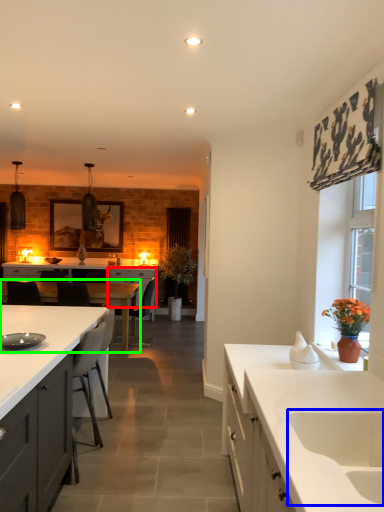
Question: Which is nearer to the cabinetry (highlighted by a red box)? sink (highlighted by a blue box) or table (highlighted by a green box).

Choices:
 (A) sink
 (B) table

Answer: (B)